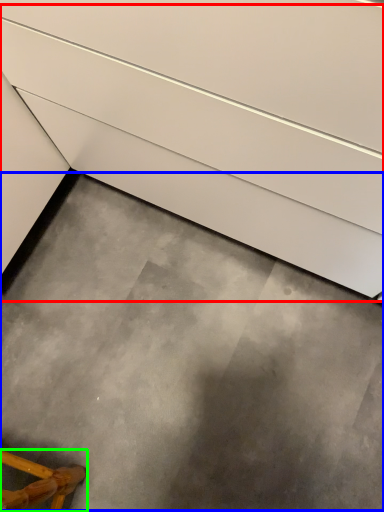
Question: Which is nearer to the stairs (highlighted by a red box)? concrete (highlighted by a blue box) or furniture (highlighted by a green box).

Choices:
 (A) concrete
 (B) furniture

Answer: (A)